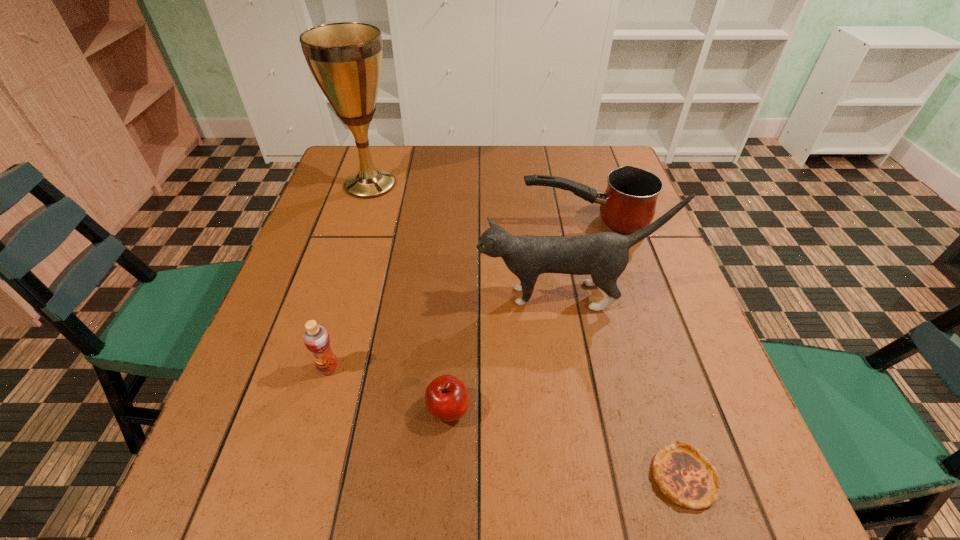
Where is `the tallest object`? The width and height of the screenshot is (960, 540). the tallest object is located at coordinates tap(345, 58).

What are the coordinates of `the farthest object` in the screenshot? It's located at (345, 58).

Find the location of `the third farthest object`. the third farthest object is located at coordinates (604, 256).

The height and width of the screenshot is (540, 960). In order to click on cat in this screenshot , I will do coord(604,256).

You are a GUI agent. You are given a task and a screenshot of the screen. Output one action in this format:
    pyautogui.click(x=<x>, y=<y>)
    Task: Click on the fifth nearest object
    The height and width of the screenshot is (540, 960).
    Given the screenshot: What is the action you would take?
    pyautogui.click(x=628, y=204)

You are a GUI agent. You are given a task and a screenshot of the screen. Output one action in this format:
    pyautogui.click(x=<x>, y=<y>)
    Task: Click on the third nearest object
    This screenshot has width=960, height=540.
    Given the screenshot: What is the action you would take?
    pyautogui.click(x=316, y=338)

Locate an element on the screen. the fourth object from right to left is located at coordinates (446, 398).

Where is `the second shortest object`? the second shortest object is located at coordinates (446, 398).

Locate an element on the screen. quiche is located at coordinates (685, 476).

Where is `the shortest object`? This screenshot has height=540, width=960. the shortest object is located at coordinates (685, 476).